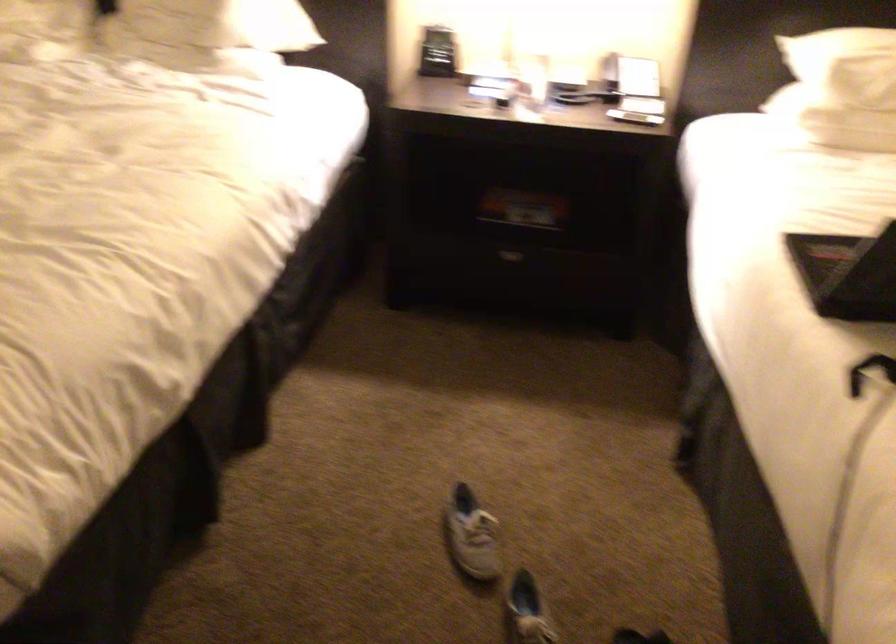
Where is `drawer handle`? drawer handle is located at coordinates (506, 261).